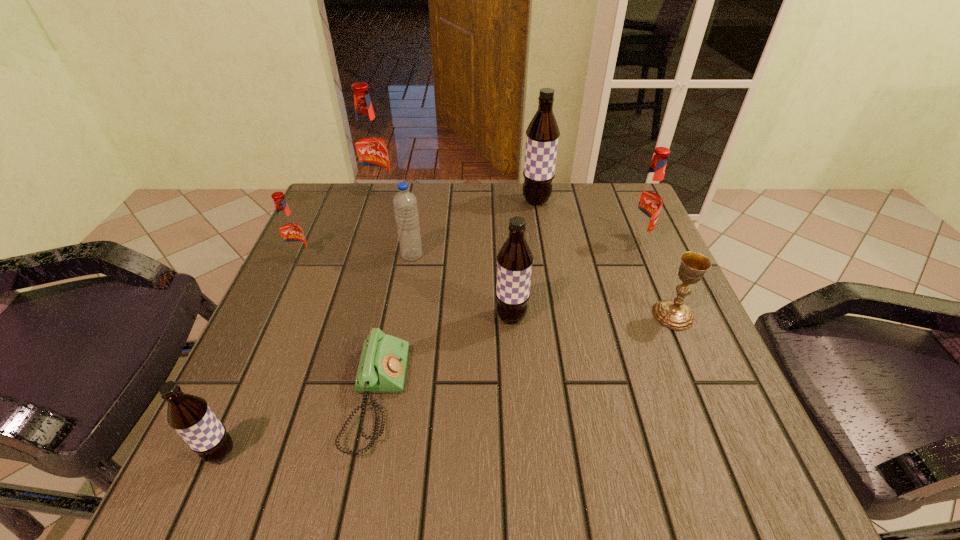
Identify the location of the farthest brown root beer. (542, 135).

You are a GUI agent. You are given a task and a screenshot of the screen. Output one action in this format:
    pyautogui.click(x=<x>, y=<y>)
    Task: Click on the rightmost brown root beer
    The image size is (960, 540).
    Given the screenshot: What is the action you would take?
    pyautogui.click(x=542, y=135)

Locate an element on the screen. The height and width of the screenshot is (540, 960). the biggest red root beer is located at coordinates (370, 146).

This screenshot has height=540, width=960. Find the location of `the third object from left to right`. the third object from left to right is located at coordinates (370, 146).

Image resolution: width=960 pixels, height=540 pixels. What are the coordinates of `the rightmost red root beer` in the screenshot? It's located at (648, 198).

Where is `the seventh nearest object`? This screenshot has height=540, width=960. the seventh nearest object is located at coordinates (648, 198).

Where is `the fourth root beer from left to right`? This screenshot has height=540, width=960. the fourth root beer from left to right is located at coordinates (514, 260).

Where is `the second smallest brown root beer`? the second smallest brown root beer is located at coordinates point(514,260).

The width and height of the screenshot is (960, 540). Identify the location of blue water bottle. (405, 203).

You are a GUI agent. You are given a task and a screenshot of the screen. Output one action in this format:
    pyautogui.click(x=<x>, y=<y>)
    Task: Click on the nearest red root beer
    This screenshot has width=960, height=540.
    Given the screenshot: What is the action you would take?
    pyautogui.click(x=290, y=232)